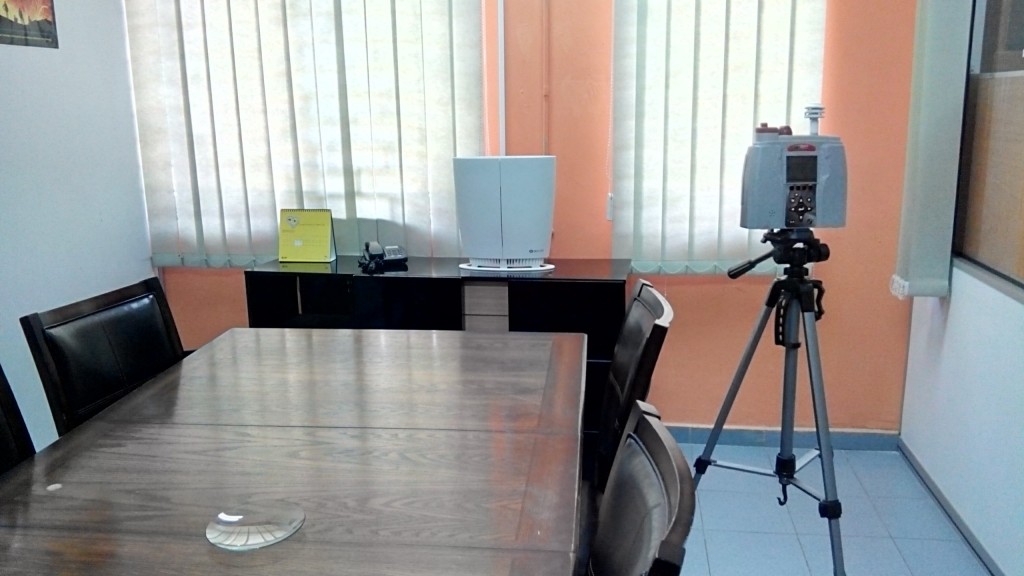
At what (x,y) coordinates should I click in order to perform the action: click on wooden conference room table. Please return your answer as a coordinate pair (x, y). The image size is (1024, 576). Looking at the image, I should click on (350, 449).